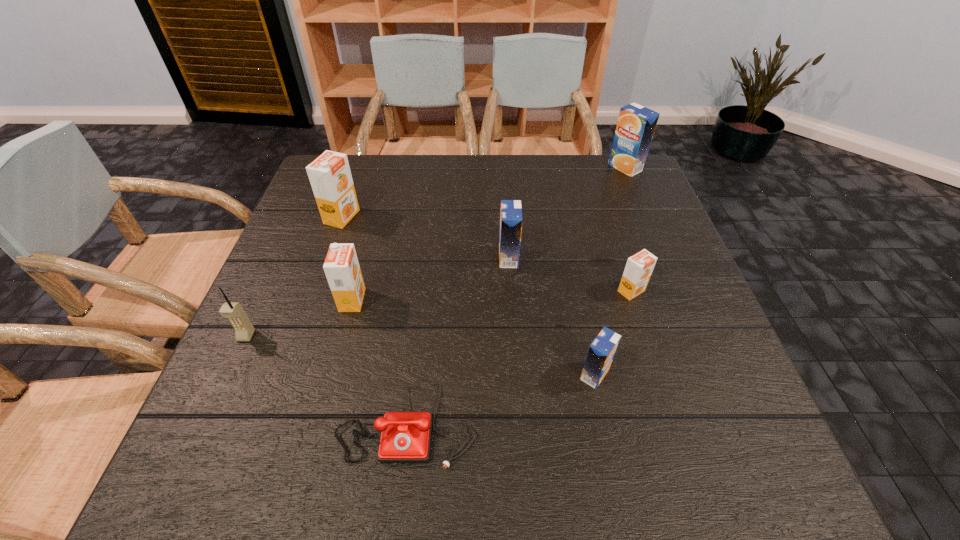
Image resolution: width=960 pixels, height=540 pixels. Identify the location of free space at the right edge of the desktop. pyautogui.click(x=713, y=392).

You are a GUI agent. You are given a task and a screenshot of the screen. Output one action in this format:
    pyautogui.click(x=<x>, y=<y>)
    Task: Click on the vacant space at the far left corner
    This screenshot has height=540, width=960.
    Given the screenshot: What is the action you would take?
    (x=353, y=173)

In the image, there is a desktop. Identify the location of vacant space at the near left corner. The width and height of the screenshot is (960, 540). (177, 472).

Find the location of `free point at the far right corner`. free point at the far right corner is located at coordinates (651, 187).

You are a GUI agent. You are given a task and a screenshot of the screen. Output one action in this format:
    pyautogui.click(x=<x>, y=<y>)
    Task: Click on the vacant space at the near right corner
    This screenshot has height=540, width=960.
    Given the screenshot: What is the action you would take?
    pyautogui.click(x=784, y=493)

Identify the location of free space between the smallest blue orange_juice and the seventh object from right to left. The height and width of the screenshot is (540, 960). (468, 296).

At what (x,y) coordinates should I click in order to perform the action: click on unoccupied area between the biggest blue orange_juice and the smallest blue orange_juice. Please return your answer as a coordinate pair (x, y). This screenshot has width=960, height=540. Looking at the image, I should click on (610, 271).

You are a GUI agent. You are given a task and a screenshot of the screen. Output one action in this format:
    pyautogui.click(x=<x>, y=<y>)
    Task: Click on the free spot between the fourth object from left to right and the leftmost object
    The height and width of the screenshot is (540, 960).
    Given the screenshot: What is the action you would take?
    pyautogui.click(x=326, y=379)

Where is `vacant area between the second orange juice from right to left and the farthest object`? The height and width of the screenshot is (540, 960). vacant area between the second orange juice from right to left and the farthest object is located at coordinates (628, 230).

Locate an element on the screen. This screenshot has height=540, width=960. free space between the leftmost object and the farthest object is located at coordinates (436, 252).